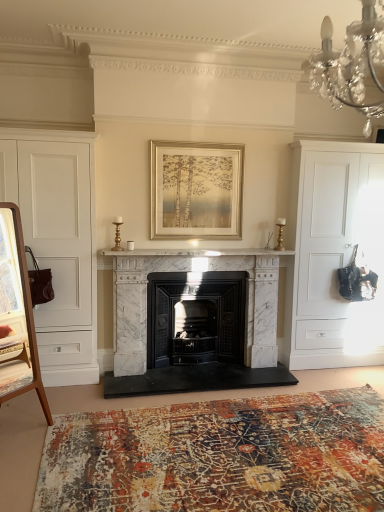
Image resolution: width=384 pixels, height=512 pixels. I want to click on free space above gold metallic picture frame at center (from a real-world perspective), so click(x=195, y=139).